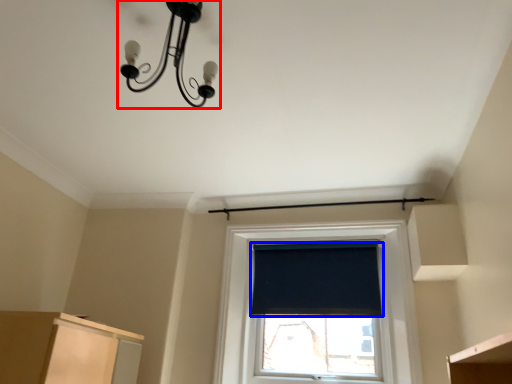
Question: Which of the following is the farthest to the observer, lamp (highlighted by a red box) or window screen (highlighted by a blue box)?

Choices:
 (A) lamp
 (B) window screen

Answer: (B)